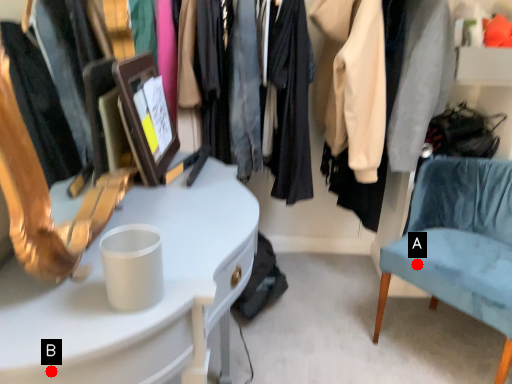
Question: Two points are circled on the image, labeled by A and B beside each circle. Among these points, which one is farthest from the camera?

Choices:
 (A) A is further
 (B) B is further

Answer: (A)